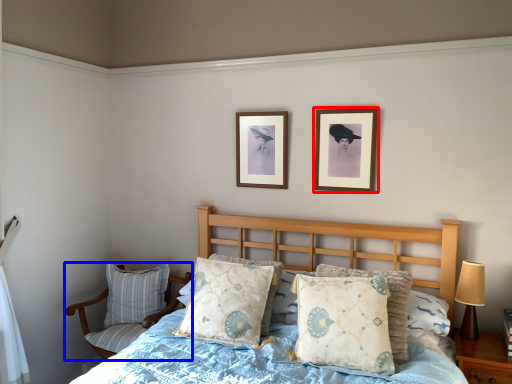
Question: Which of the following is the closest to the observer, picture frame (highlighted by a red box) or chair (highlighted by a blue box)?

Choices:
 (A) picture frame
 (B) chair

Answer: (A)